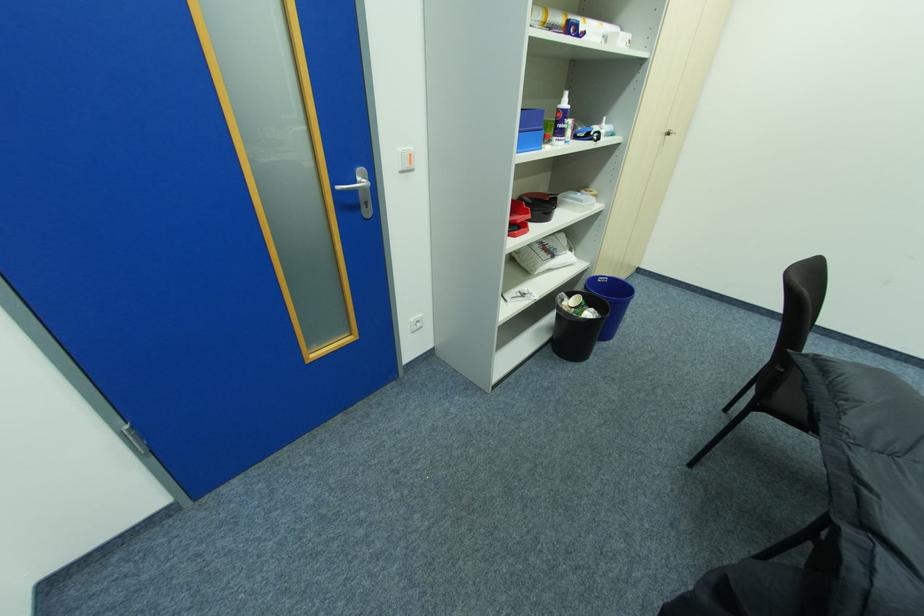
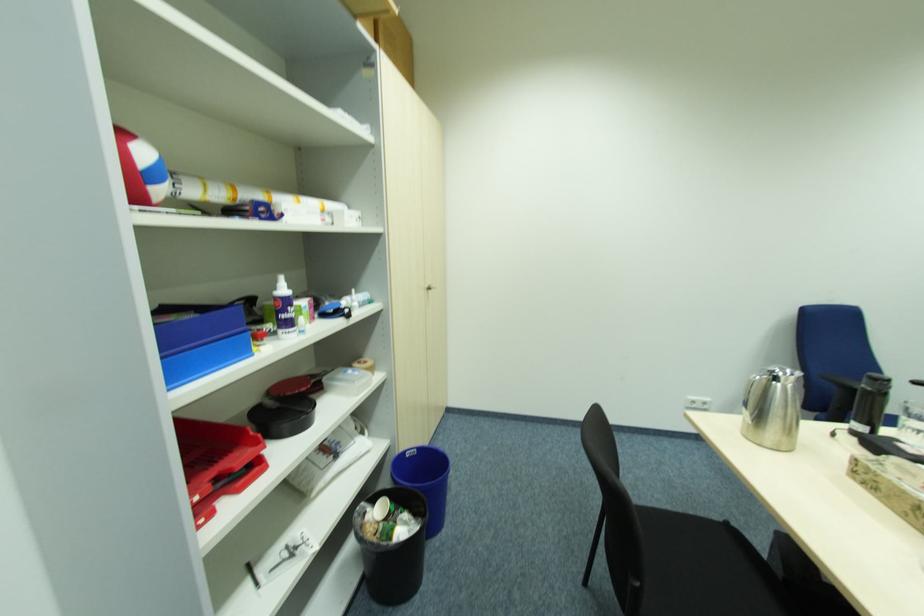
How did the camera likely rotate?

The rotation direction of the camera is right-up.